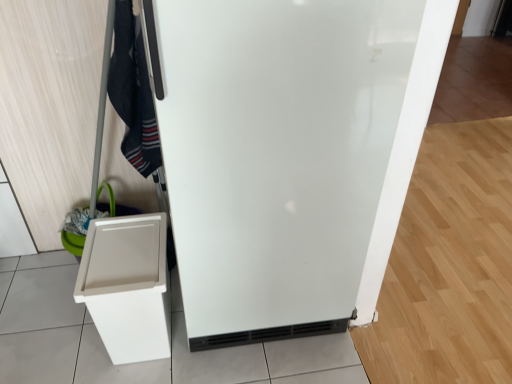
Question: From the image's perspective, is black cotton scarf at upper left on white plastic bin at lower left?

Choices:
 (A) yes
 (B) no

Answer: (A)

Question: Can you confirm if black cotton scarf at upper left is shorter than white plastic bin at lower left?

Choices:
 (A) yes
 (B) no

Answer: (B)

Question: Can white plastic bin at lower left be found inside black cotton scarf at upper left?

Choices:
 (A) no
 (B) yes

Answer: (A)

Question: Considering the relative positions of black cotton scarf at upper left and white plastic bin at lower left in the image provided, is black cotton scarf at upper left in front of white plastic bin at lower left?

Choices:
 (A) yes
 (B) no

Answer: (A)

Question: Is black cotton scarf at upper left turned away from white plastic bin at lower left?

Choices:
 (A) yes
 (B) no

Answer: (B)

Question: Are black cotton scarf at upper left and white plastic bin at lower left located far from each other?

Choices:
 (A) yes
 (B) no

Answer: (B)

Question: From a real-world perspective, is black cotton scarf at upper left physically above white glossy refrigerator at center?

Choices:
 (A) yes
 (B) no

Answer: (A)

Question: Considering the relative sizes of black cotton scarf at upper left and white glossy refrigerator at center in the image provided, is black cotton scarf at upper left shorter than white glossy refrigerator at center?

Choices:
 (A) no
 (B) yes

Answer: (B)

Question: Is black cotton scarf at upper left positioned with its back to white glossy refrigerator at center?

Choices:
 (A) yes
 (B) no

Answer: (B)

Question: Does black cotton scarf at upper left contain white glossy refrigerator at center?

Choices:
 (A) no
 (B) yes

Answer: (A)

Question: Is black cotton scarf at upper left not near white glossy refrigerator at center?

Choices:
 (A) no
 (B) yes

Answer: (A)

Question: Does black cotton scarf at upper left have a lesser width compared to white glossy refrigerator at center?

Choices:
 (A) yes
 (B) no

Answer: (A)

Question: Is white glossy refrigerator at center positioned in front of white plastic bin at lower left?

Choices:
 (A) yes
 (B) no

Answer: (A)